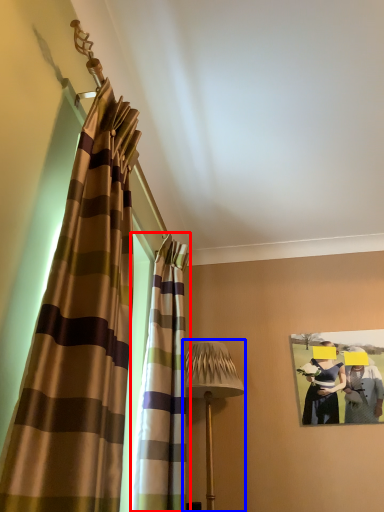
Question: Which object is closer to the camera taking this photo, curtain (highlighted by a red box) or table lamp (highlighted by a blue box)?

Choices:
 (A) curtain
 (B) table lamp

Answer: (A)